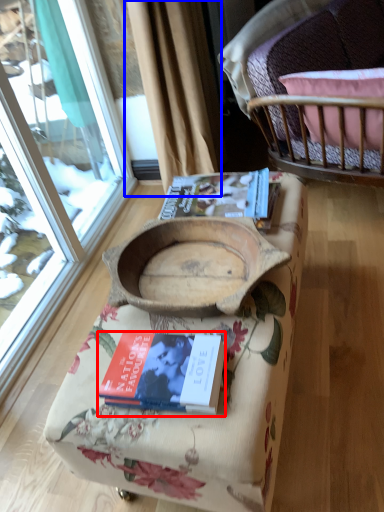
Question: Which object appears farthest to the camera in this image, book (highlighted by a red box) or curtain (highlighted by a blue box)?

Choices:
 (A) book
 (B) curtain

Answer: (B)